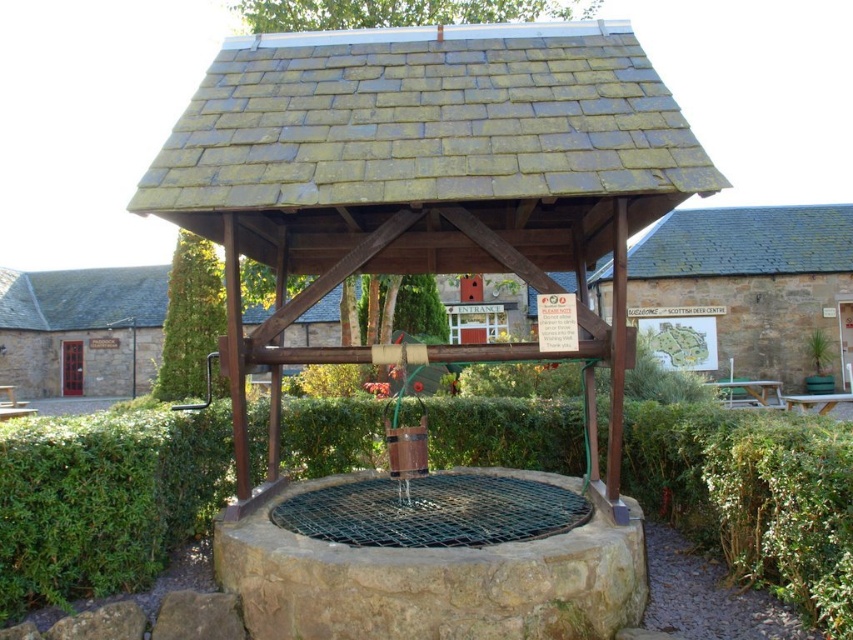
You are a gardener planning to trim both the green leafy hedge at center and the green leafy bush at center. Which one requires more time to trim based on their sizes?

The green leafy bush at center requires more time to trim because its width is greater than the green leafy hedge at center.

You are standing at the center of the well structure and want to place a decorative stone. Where should you place it so that it is closest to the green leafy hedge at center?

The green leafy hedge at center is located at point [103,499], so placing the decorative stone near that coordinate would be closest to it.